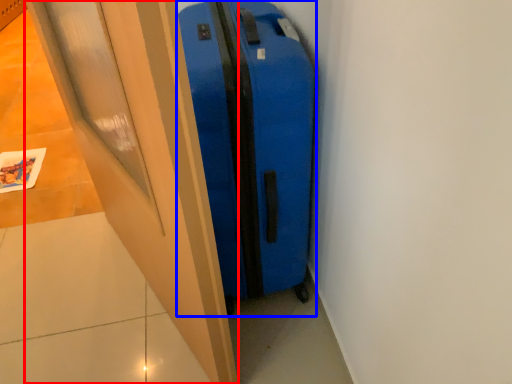
Question: Which object appears closest to the camera in this image, door (highlighted by a red box) or suitcase (highlighted by a blue box)?

Choices:
 (A) door
 (B) suitcase

Answer: (A)